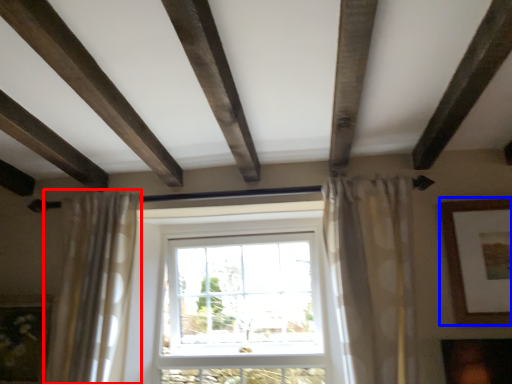
Question: Which point is further to the camera, curtain (highlighted by a red box) or picture frame (highlighted by a blue box)?

Choices:
 (A) curtain
 (B) picture frame

Answer: (B)